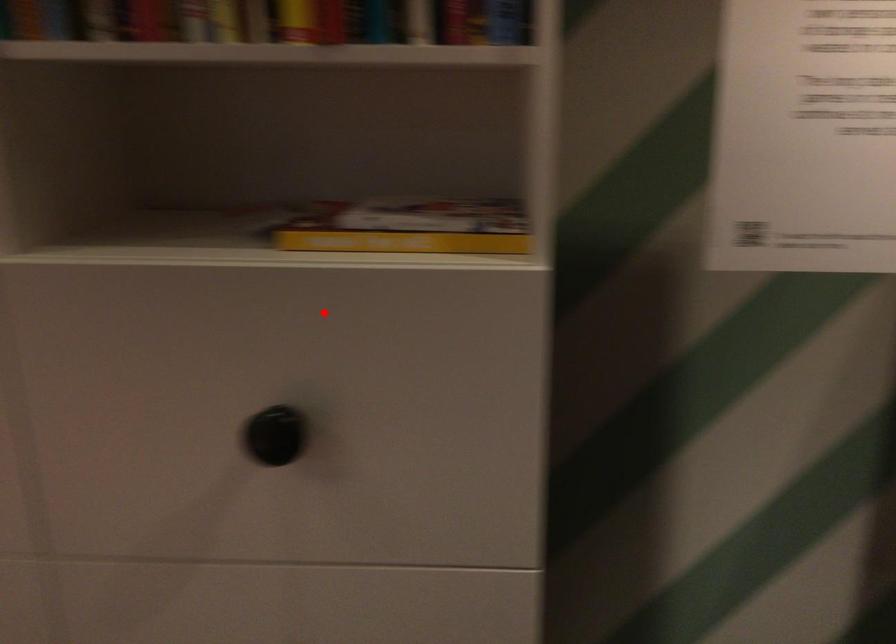
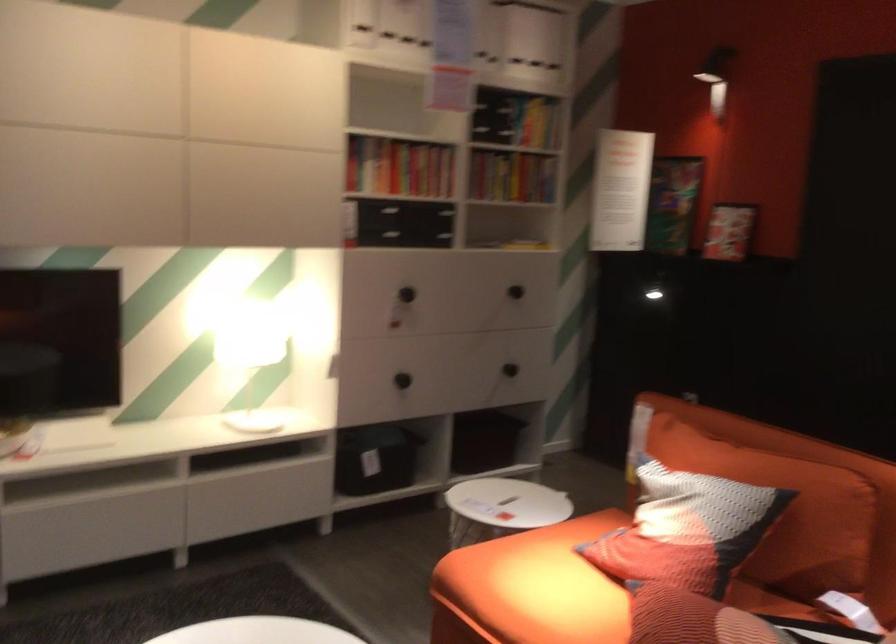
Question: I am providing you with two images of the same scene from different viewpoints. Image1 has a red point marked. In image2, the corresponding 3D location appears at what relative position? Reply with the corresponding letter.

Choices:
 (A) Closer
 (B) Farther

Answer: (B)